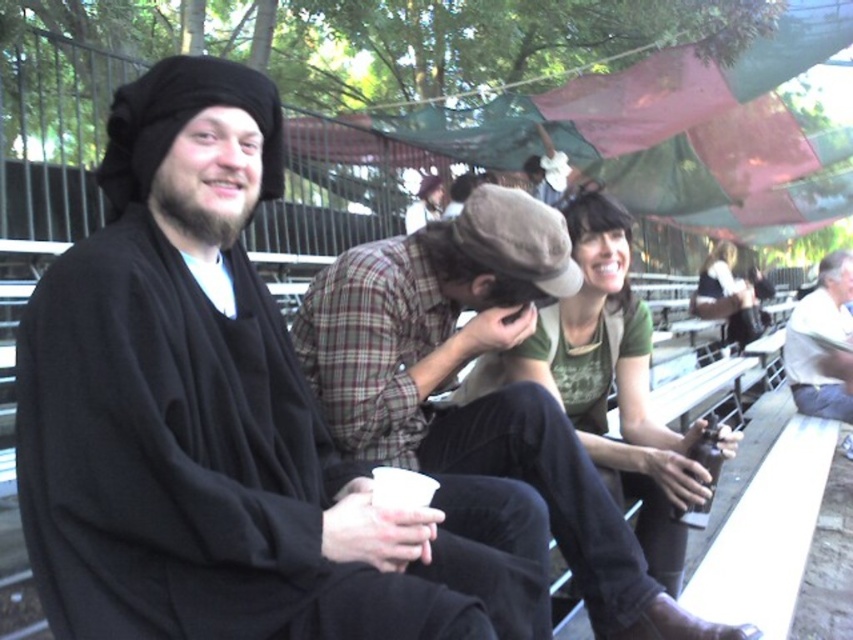
Who is lower down, light brown leather jacket at right or matte green shirt at center?

light brown leather jacket at right is below.

Is point (807, 337) more distant than point (715, 307)?

No.

Is point (840, 300) farther from viewer compared to point (724, 317)?

No, it is not.

Find the location of a particular element. The height and width of the screenshot is (640, 853). light brown leather jacket at right is located at coordinates (817, 344).

In order to click on plaid shirt at center in this screenshot , I will do `click(485, 396)`.

What do you see at coordinates (485, 396) in the screenshot? I see `plaid shirt at center` at bounding box center [485, 396].

This screenshot has height=640, width=853. I want to click on plaid shirt at center, so click(485, 396).

Does point (405, 324) come farther from viewer compared to point (839, 312)?

No, it is in front of (839, 312).

Is plaid shirt at center wider than light brown leather jacket at right?

Correct, the width of plaid shirt at center exceeds that of light brown leather jacket at right.

Between point (492, 467) and point (811, 353), which one is positioned behind?

The point (811, 353) is more distant.

Identify the location of plaid shirt at center. The width and height of the screenshot is (853, 640). (485, 396).